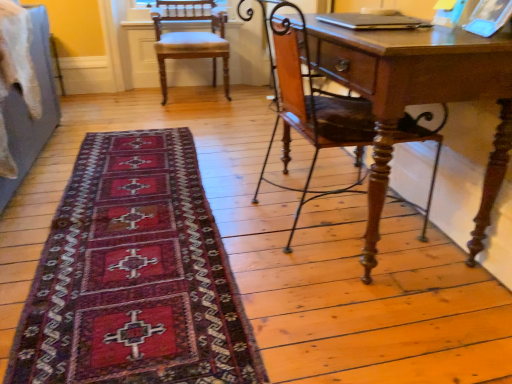
Question: Can you confirm if wooden chair at right, the 2th chair viewed from the back, is wider than dark red woven rug at lower left?

Choices:
 (A) no
 (B) yes

Answer: (A)

Question: From the image's perspective, is wooden chair at right, positioned as the 1th chair in bottom-to-top order, over dark red woven rug at lower left?

Choices:
 (A) no
 (B) yes

Answer: (B)

Question: Does wooden chair at right, marked as the 2th chair in a left-to-right arrangement, appear on the left side of dark red woven rug at lower left?

Choices:
 (A) yes
 (B) no

Answer: (B)

Question: From a real-world perspective, is wooden chair at right, which is the second chair in top-to-bottom order, over dark red woven rug at lower left?

Choices:
 (A) no
 (B) yes

Answer: (B)

Question: Is the depth of wooden chair at right, the 2th chair viewed from the back, less than that of dark red woven rug at lower left?

Choices:
 (A) no
 (B) yes

Answer: (A)

Question: Considering the positions of wooden chair at right, marked as the 2th chair in a left-to-right arrangement, and dark red woven rug at lower left in the image, is wooden chair at right, marked as the 2th chair in a left-to-right arrangement, bigger or smaller than dark red woven rug at lower left?

Choices:
 (A) small
 (B) big

Answer: (B)

Question: Is wooden chair at right, which ranks as the 1th chair in right-to-left order, wider or thinner than dark red woven rug at lower left?

Choices:
 (A) thin
 (B) wide

Answer: (A)

Question: Is wooden chair at right, which ranks as the 1th chair in right-to-left order, in front of or behind dark red woven rug at lower left in the image?

Choices:
 (A) front
 (B) behind

Answer: (B)

Question: From the image's perspective, is wooden chair at right, positioned as the 1th chair in front-to-back order, positioned above or below dark red woven rug at lower left?

Choices:
 (A) above
 (B) below

Answer: (A)

Question: Which is correct: dark red woven rug at lower left is inside wooden chair at right, which is the second chair in top-to-bottom order, or outside of it?

Choices:
 (A) outside
 (B) inside

Answer: (A)

Question: Is dark red woven rug at lower left wider or thinner than wooden chair at right, positioned as the 1th chair in front-to-back order?

Choices:
 (A) wide
 (B) thin

Answer: (A)

Question: In terms of height, does dark red woven rug at lower left look taller or shorter compared to wooden chair at right, positioned as the 1th chair in bottom-to-top order?

Choices:
 (A) short
 (B) tall

Answer: (A)

Question: From a real-world perspective, is dark red woven rug at lower left positioned above or below wooden chair at right, the 2th chair viewed from the back?

Choices:
 (A) below
 (B) above

Answer: (A)

Question: In terms of height, does wooden chair at right, positioned as the 1th chair in bottom-to-top order, look taller or shorter compared to light brown wood chair at upper left, placed as the second chair when sorted from bottom to top?

Choices:
 (A) short
 (B) tall

Answer: (B)

Question: From a real-world perspective, is wooden chair at right, positioned as the 1th chair in front-to-back order, above or below light brown wood chair at upper left, which appears as the 1th chair when viewed from the back?

Choices:
 (A) below
 (B) above

Answer: (B)